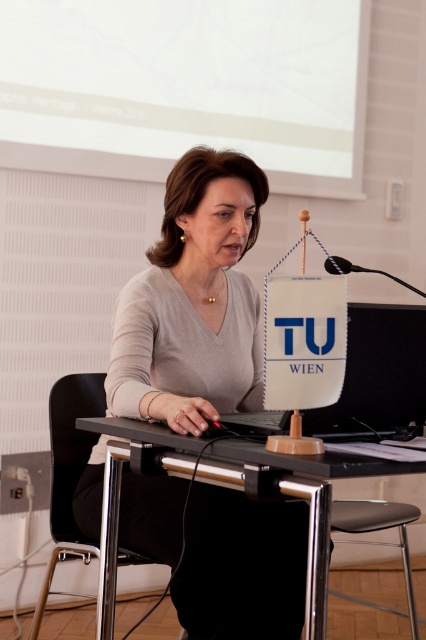
Question: Can you confirm if white matte projection screen at upper center is smaller than black plastic table at center?

Choices:
 (A) no
 (B) yes

Answer: (A)

Question: Which of these objects is positioned farthest from the matte gray sweater at center?

Choices:
 (A) black plastic table at center
 (B) white matte projection screen at upper center
 (C) black plastic chair at center

Answer: (B)

Question: Which object appears closest to the camera in this image?

Choices:
 (A) matte gray sweater at center
 (B) white matte projection screen at upper center

Answer: (A)

Question: Considering the real-world distances, which object is farthest from the black plastic chair at center?

Choices:
 (A) white matte projection screen at upper center
 (B) matte gray sweater at center
 (C) black plastic table at center

Answer: (A)

Question: Is white matte projection screen at upper center wider than black plastic chair at center?

Choices:
 (A) yes
 (B) no

Answer: (A)

Question: Where is matte gray sweater at center located in relation to black plastic chair at center in the image?

Choices:
 (A) left
 (B) right

Answer: (B)